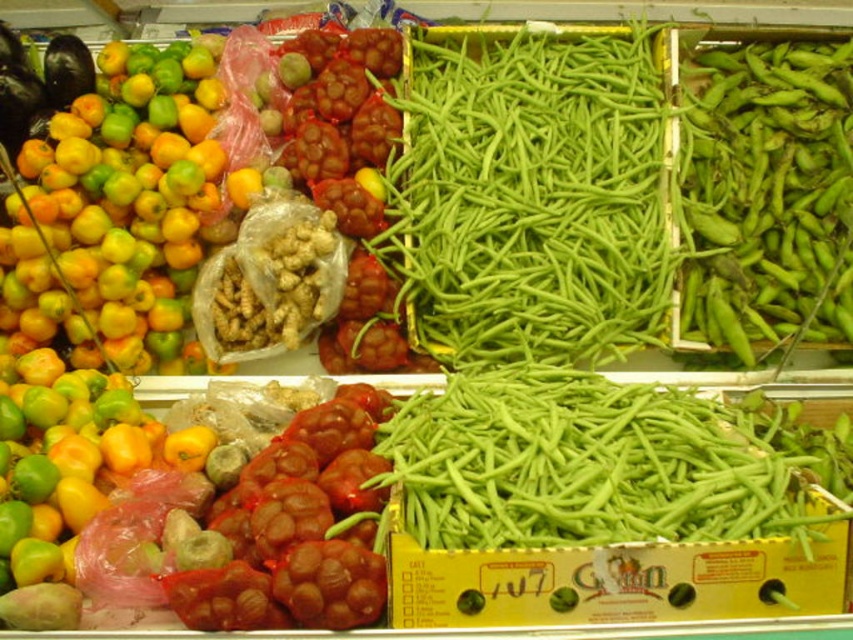
Question: Can you confirm if green smooth beans at center is bigger than green matte pod at upper right?

Choices:
 (A) yes
 (B) no

Answer: (A)

Question: Which point is farther to the camera?

Choices:
 (A) green matte pod at upper right
 (B) green smooth beans at center

Answer: (A)

Question: Is green smooth beans at center closer to camera compared to green matte pod at upper right?

Choices:
 (A) yes
 (B) no

Answer: (A)

Question: Is green smooth beans at center to the right of green matte pod at upper right from the viewer's perspective?

Choices:
 (A) yes
 (B) no

Answer: (B)